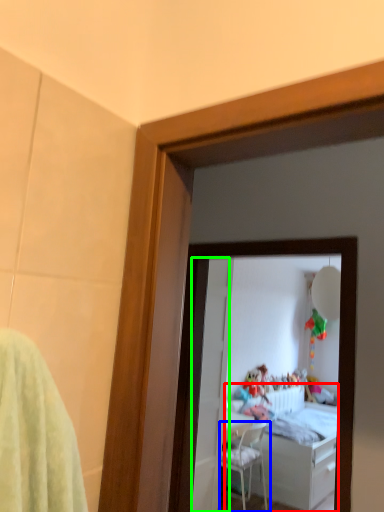
Question: Which is nearer to the bed (highlighted by a red box)? chair (highlighted by a blue box) or door (highlighted by a green box).

Choices:
 (A) chair
 (B) door

Answer: (A)